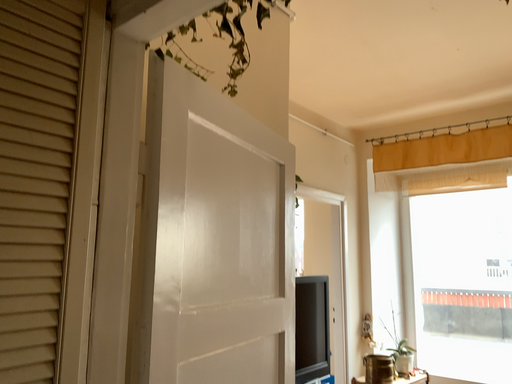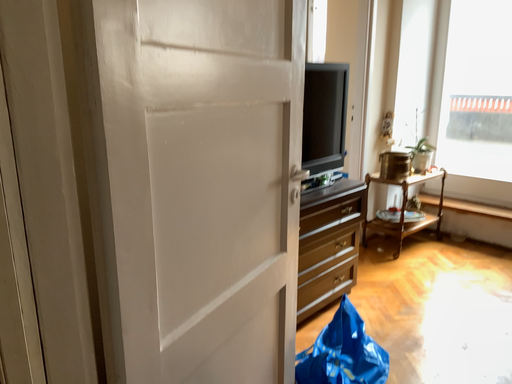
Question: Which way did the camera rotate in the video?

Choices:
 (A) rotated downward
 (B) rotated upward

Answer: (A)